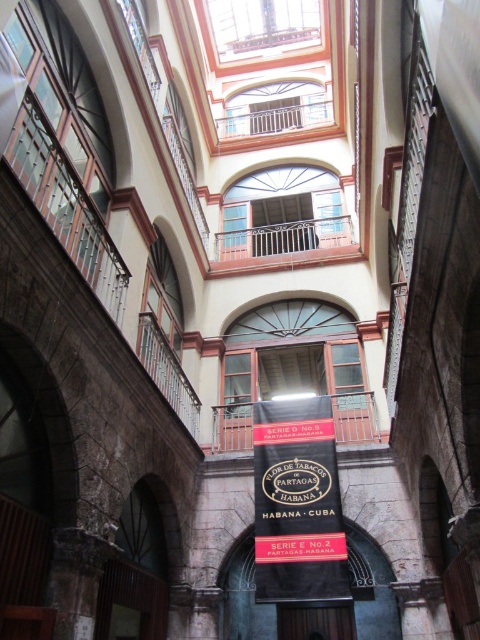
Question: Among these points, which one is nearest to the camera?

Choices:
 (A) (279, 426)
 (B) (377, 547)

Answer: (B)

Question: Is black fabric banner at center below wooden railing at upper center?

Choices:
 (A) yes
 (B) no

Answer: (A)

Question: Among these objects, which one is nearest to the camera?

Choices:
 (A) metallic balcony at center
 (B) black fabric banner at center
 (C) bronze sign at center

Answer: (C)

Question: Considering the relative positions of bronze sign at center and metallic balcony at center in the image provided, where is bronze sign at center located with respect to metallic balcony at center?

Choices:
 (A) below
 (B) above

Answer: (A)

Question: Is black fabric banner at center below wooden railing at upper center?

Choices:
 (A) yes
 (B) no

Answer: (A)

Question: Which of these objects is positioned closest to the black fabric banner at center?

Choices:
 (A) metallic balcony at center
 (B) bronze sign at center

Answer: (A)